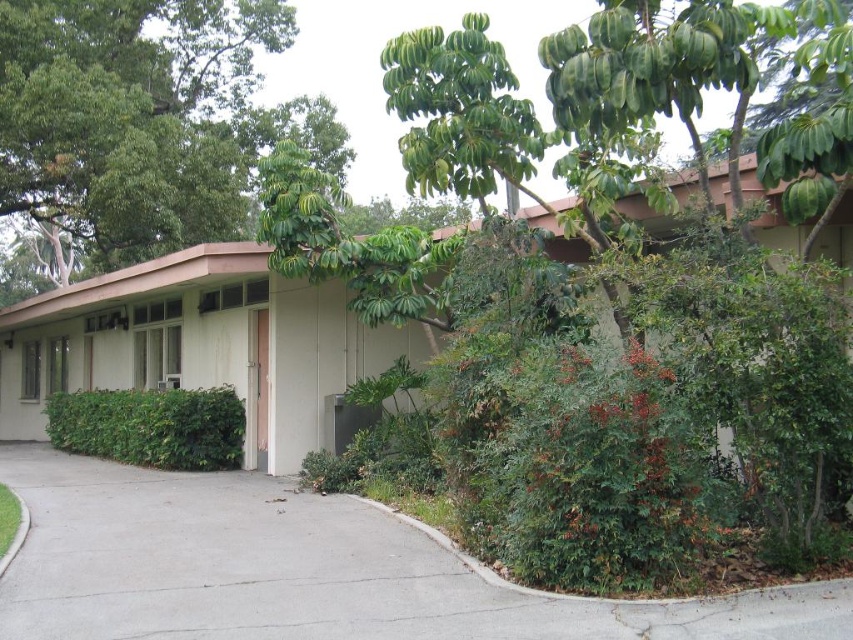
Question: Observing the image, what is the correct spatial positioning of gray concrete driveway at lower left in reference to green leafy tree at upper left?

Choices:
 (A) above
 (B) below

Answer: (B)

Question: Which of the following is the closest to the observer?

Choices:
 (A) green leafy tree at upper left
 (B) green leafy bush at lower left

Answer: (B)

Question: Which point is farther to the camera?

Choices:
 (A) (143, 24)
 (B) (154, 436)
 (C) (122, 620)

Answer: (A)

Question: Does gray concrete driveway at lower left have a greater width compared to green leafy bush at lower left?

Choices:
 (A) no
 (B) yes

Answer: (B)

Question: Can you confirm if green leafy tree at upper left is positioned above green leafy bush at lower left?

Choices:
 (A) no
 (B) yes

Answer: (B)

Question: Which object is farther from the camera taking this photo?

Choices:
 (A) gray concrete driveway at lower left
 (B) green leafy tree at upper left

Answer: (B)